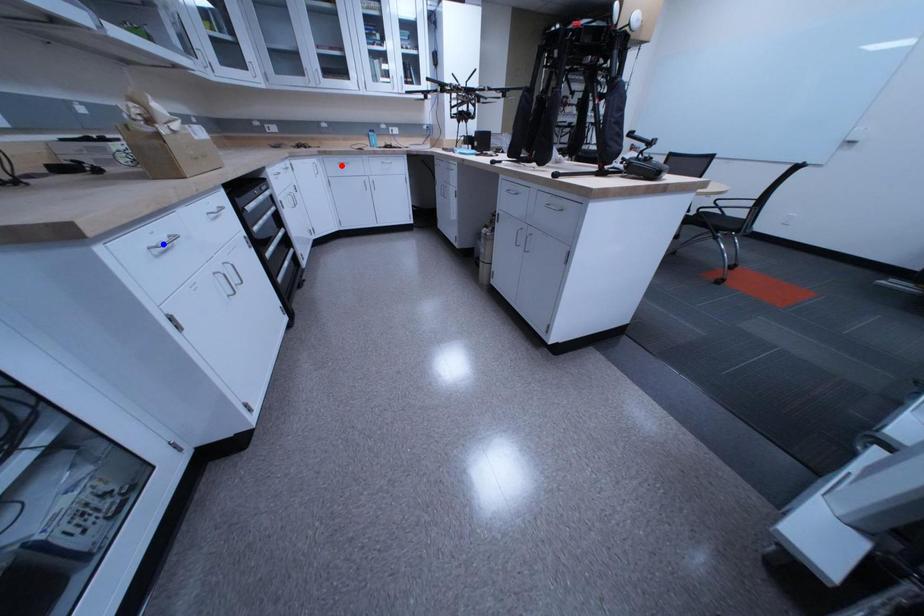
Question: Which of the two points in the image is closer to the camera?

Choices:
 (A) Blue point is closer.
 (B) Red point is closer.

Answer: (A)